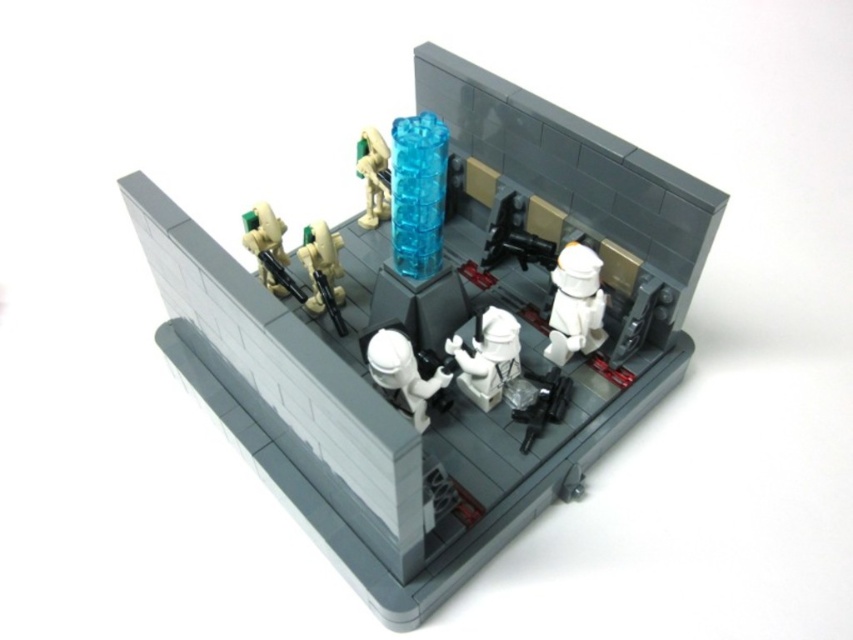
Question: Is translucent blue plastic column at center closer to camera compared to white matte stormtrooper helmet at center?

Choices:
 (A) no
 (B) yes

Answer: (B)

Question: Which object is the farthest from the white matte stormtrooper at center?

Choices:
 (A) white matte stormtrooper helmet at center
 (B) translucent blue tower at center
 (C) translucent blue plastic column at center
 (D) white matte figure at center

Answer: (B)

Question: Which point is closer to the camera?

Choices:
 (A) translucent blue tower at center
 (B) translucent blue plastic column at center
 (C) white matte stormtrooper at center
 (D) white matte stormtrooper helmet at center

Answer: (B)

Question: Which is nearer to the white matte stormtrooper helmet at center?

Choices:
 (A) translucent blue tower at center
 (B) white matte stormtrooper at center
 (C) translucent blue plastic column at center

Answer: (C)

Question: Can you confirm if white matte figure at center is bigger than translucent blue tower at center?

Choices:
 (A) yes
 (B) no

Answer: (B)

Question: Is white matte stormtrooper at center in front of translucent blue tower at center?

Choices:
 (A) no
 (B) yes

Answer: (B)